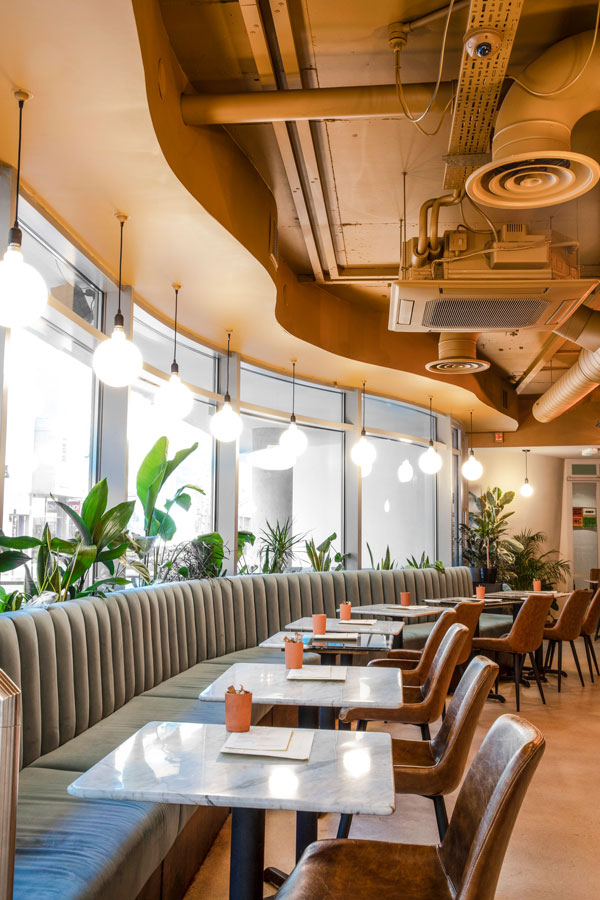
Locate an element on the screen. The height and width of the screenshot is (900, 600). lights hanging from ceiling is located at coordinates (9, 293), (117, 361), (176, 401), (227, 425), (289, 444), (364, 454), (428, 464), (472, 472), (526, 490).